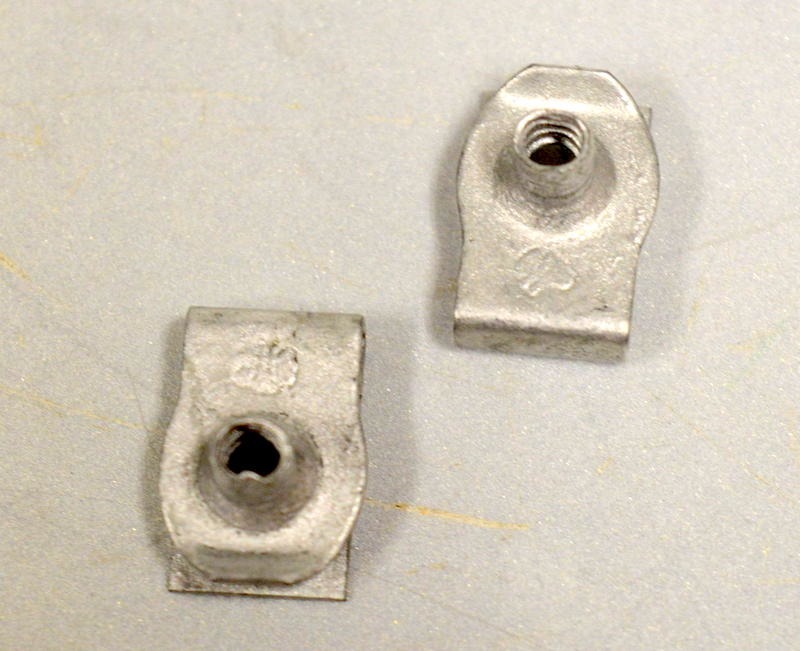
This screenshot has width=800, height=651. What are the coordinates of `countertop` in the screenshot? It's located at (441, 419).